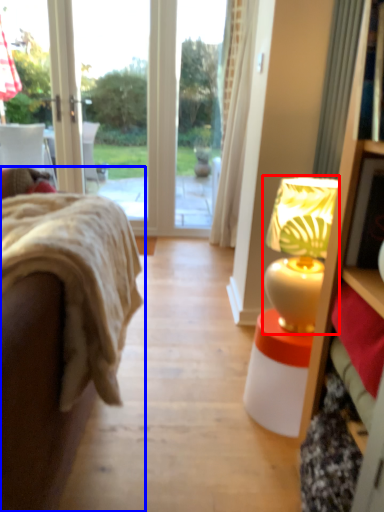
Question: Which point is closer to the camera, table lamp (highlighted by a red box) or studio couch (highlighted by a blue box)?

Choices:
 (A) table lamp
 (B) studio couch

Answer: (B)